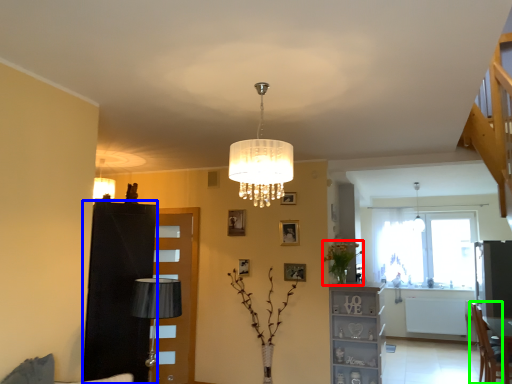
Question: Which is farther away from plant (highlighted by a red box)? dresser (highlighted by a blue box) or armchair (highlighted by a green box)?

Choices:
 (A) dresser
 (B) armchair

Answer: (A)